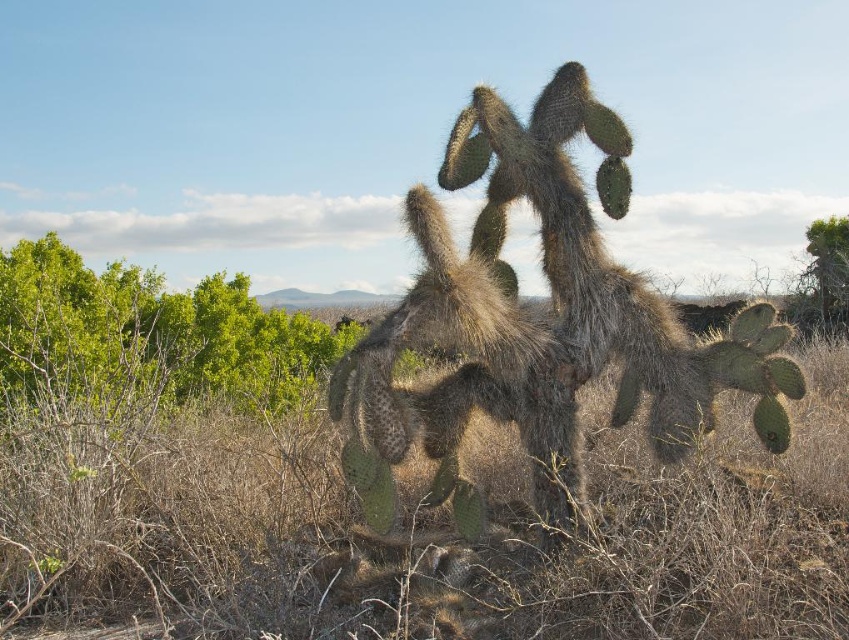
Consider the image. Is brown dry grass at center wider than spiky green cactus at center?

No.

Does brown dry grass at center have a smaller size compared to spiky green cactus at center?

Yes.

Is point (99, 602) positioned before point (470, 268)?

No.

Find the location of a particular element. This screenshot has width=849, height=640. brown dry grass at center is located at coordinates (437, 536).

Does spiky green cactus at center have a lesser width compared to green leafy shrubs at left?

Correct, spiky green cactus at center's width is less than green leafy shrubs at left's.

Is spiky green cactus at center smaller than green leafy shrubs at left?

Yes.

The image size is (849, 640). In order to click on spiky green cactus at center in this screenshot , I will do `click(540, 324)`.

Locate an element on the screen. The image size is (849, 640). spiky green cactus at center is located at coordinates (540, 324).

Does brown dry grass at center appear on the left side of green leafy shrubs at left?

Incorrect, brown dry grass at center is not on the left side of green leafy shrubs at left.

Is brown dry grass at center above green leafy shrubs at left?

Incorrect, brown dry grass at center is not positioned above green leafy shrubs at left.

Which is in front, point (829, 522) or point (284, 397)?

Point (829, 522) is more forward.

You are a GUI agent. You are given a task and a screenshot of the screen. Output one action in this format:
    pyautogui.click(x=<x>, y=<y>)
    Task: Click on the brown dry grass at center
    
    Given the screenshot: What is the action you would take?
    pyautogui.click(x=437, y=536)